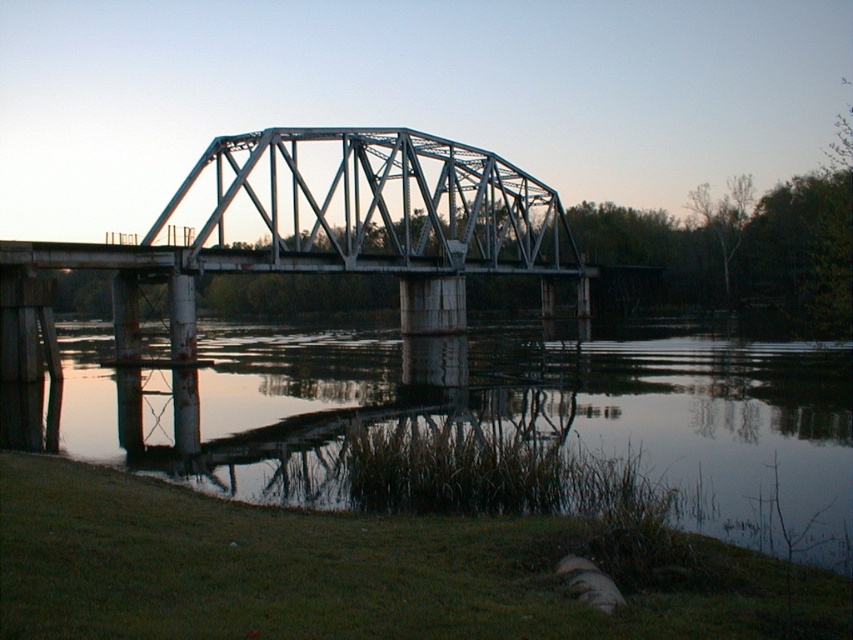
Based on the photo, is smooth reflective water at lower center to the right of metallic gray bridge at center from the viewer's perspective?

Indeed, smooth reflective water at lower center is positioned on the right side of metallic gray bridge at center.

Between point (96, 408) and point (235, 180), which one is positioned behind?

Point (235, 180)

Where is `smooth reflective water at lower center`? This screenshot has width=853, height=640. smooth reflective water at lower center is located at coordinates (480, 412).